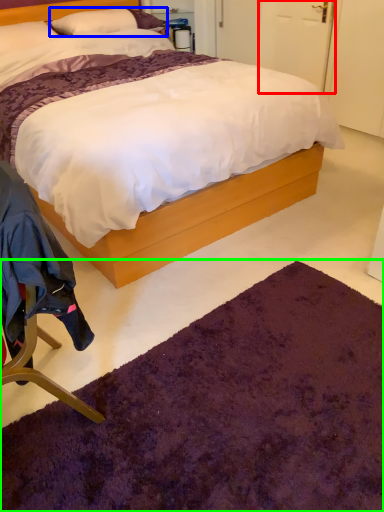
Question: Which is farther away from door (highlighted by a red box)? pillow (highlighted by a blue box) or mat (highlighted by a green box)?

Choices:
 (A) pillow
 (B) mat

Answer: (B)